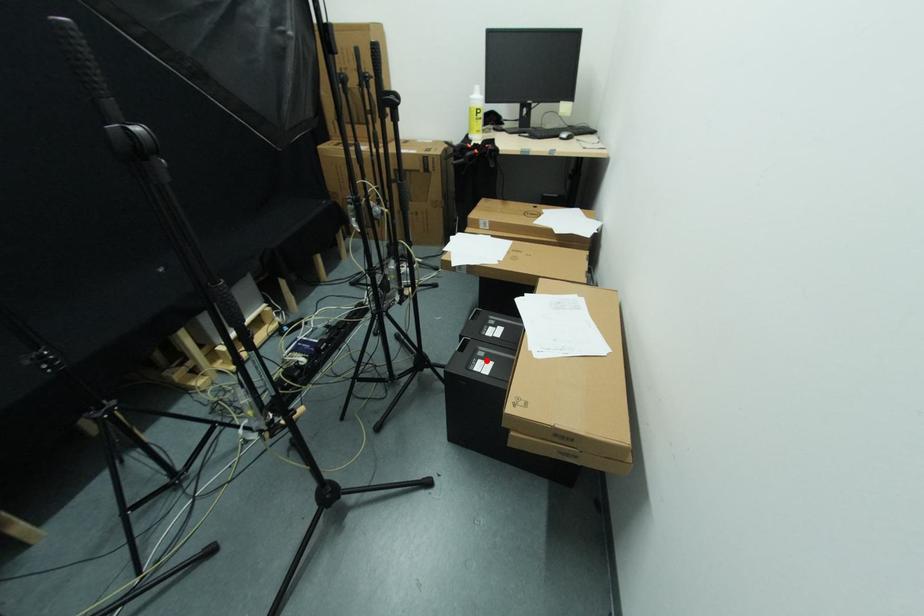
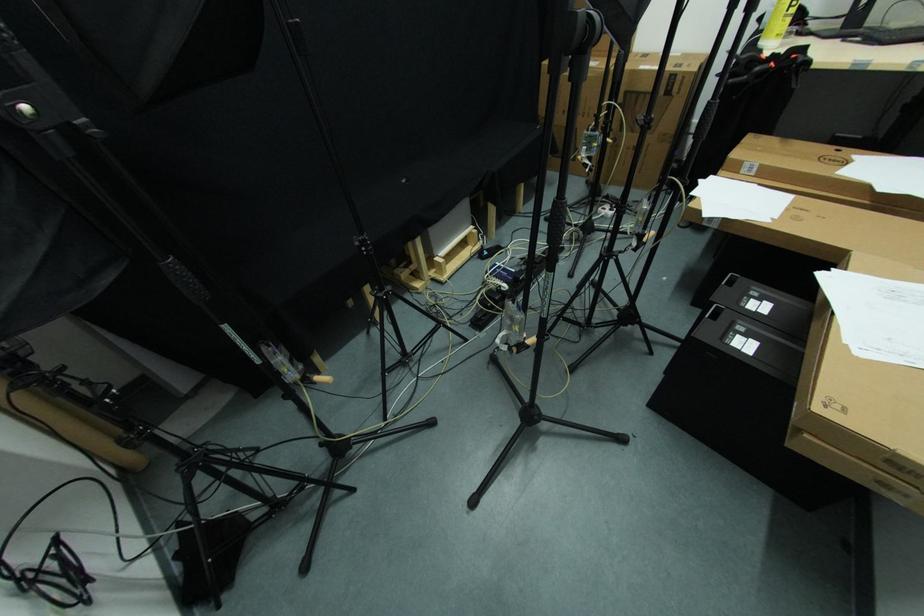
In the second image, find the point that corresponds to the highlighted location in the first image.

(748, 339)